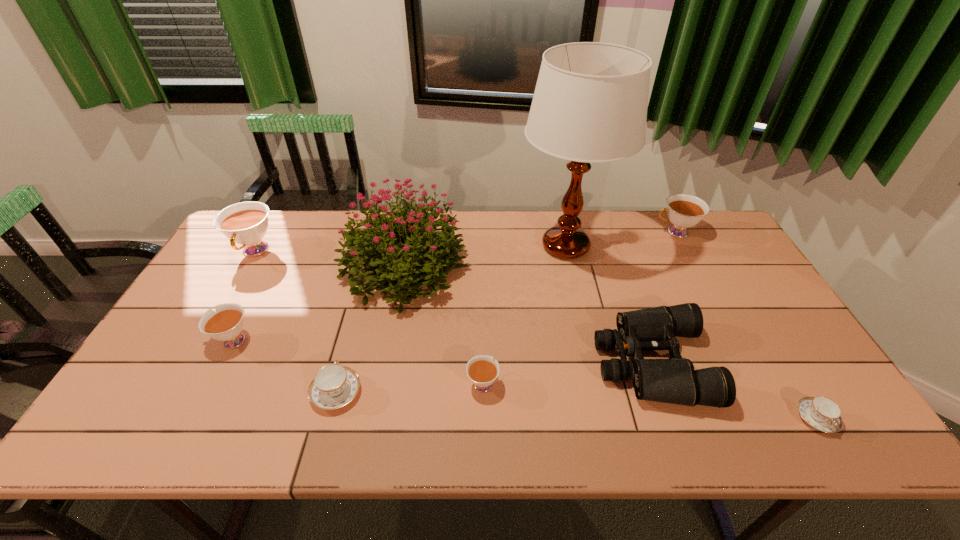
Locate an element on the screen. The image size is (960, 540). the tallest object is located at coordinates (590, 103).

Find the location of a particular element. The image size is (960, 540). table lamp is located at coordinates (590, 103).

Identify the location of the second tallest object. (426, 249).

Find the location of a particular element. The height and width of the screenshot is (540, 960). green bouquet is located at coordinates (426, 249).

Locate an element on the screen. the third tallest object is located at coordinates (245, 223).

This screenshot has width=960, height=540. I want to click on the tallest teacup, so click(245, 223).

Where is `the rightmost white teacup`? The width and height of the screenshot is (960, 540). the rightmost white teacup is located at coordinates (684, 211).

Find the location of a particular element. The height and width of the screenshot is (540, 960). the second tallest teacup is located at coordinates (684, 211).

Where is `black binoculars`? Image resolution: width=960 pixels, height=540 pixels. black binoculars is located at coordinates (674, 380).

This screenshot has width=960, height=540. I want to click on the fourth nearest teacup, so 226,324.